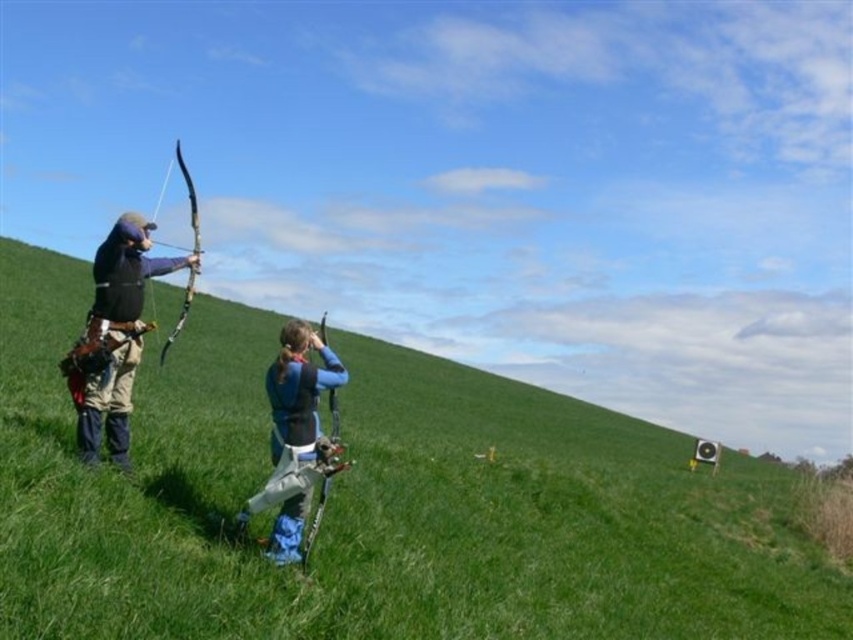
Question: Which point is farther to the camera?

Choices:
 (A) (128, 435)
 (B) (405, 403)

Answer: (B)

Question: Can you confirm if blue fabric bow at center is thinner than wooden bow at left?

Choices:
 (A) yes
 (B) no

Answer: (A)

Question: Which of these objects is positioned closest to the matte black archery bow at left?

Choices:
 (A) wooden bow at left
 (B) blue fabric bow at center
 (C) blue fabric jacket at center

Answer: (C)

Question: Does green grassy hillside at center lie behind wooden bow at left?

Choices:
 (A) yes
 (B) no

Answer: (B)

Question: Which point appears closest to the camera in this image?

Choices:
 (A) (160, 352)
 (B) (300, 476)

Answer: (B)

Question: Does green grassy hillside at center appear on the left side of matte black archery bow at left?

Choices:
 (A) no
 (B) yes

Answer: (A)